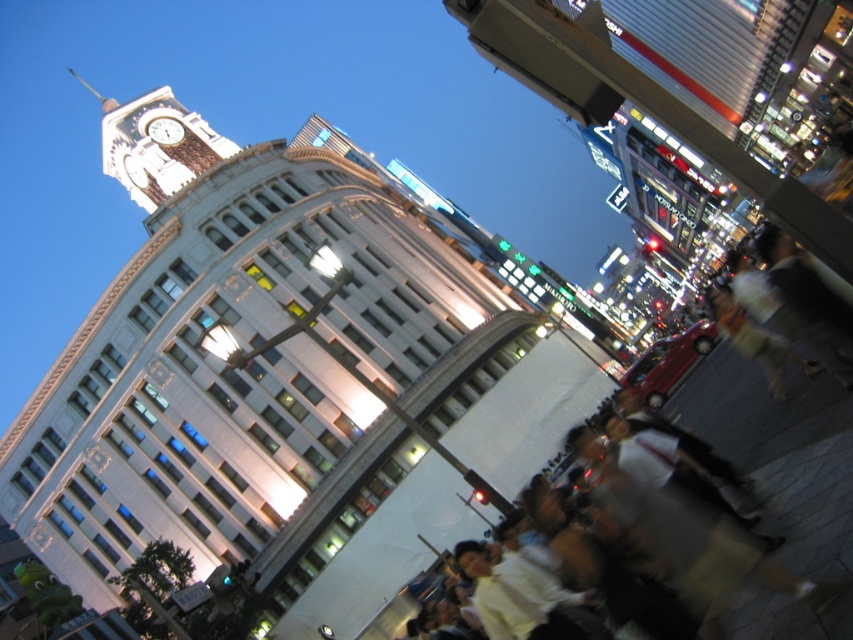
Question: Which object is the closest to the white stone clock tower at upper left?

Choices:
 (A) matte white clock at upper left
 (B) light beige shirt at lower right

Answer: (A)

Question: Among these points, which one is farthest from the camera?

Choices:
 (A) (788, 637)
 (B) (155, 138)

Answer: (B)

Question: Does light beige shirt at lower right have a lesser width compared to white stone clock tower at upper left?

Choices:
 (A) no
 (B) yes

Answer: (B)

Question: Can you confirm if white stone clock tower at upper left is positioned above matte white clock at upper left?

Choices:
 (A) no
 (B) yes

Answer: (B)

Question: Does white stone clock tower at upper left appear on the right side of matte white clock at upper left?

Choices:
 (A) yes
 (B) no

Answer: (B)

Question: Among these objects, which one is nearest to the camera?

Choices:
 (A) light beige shirt at lower right
 (B) white stone clock tower at upper left

Answer: (A)